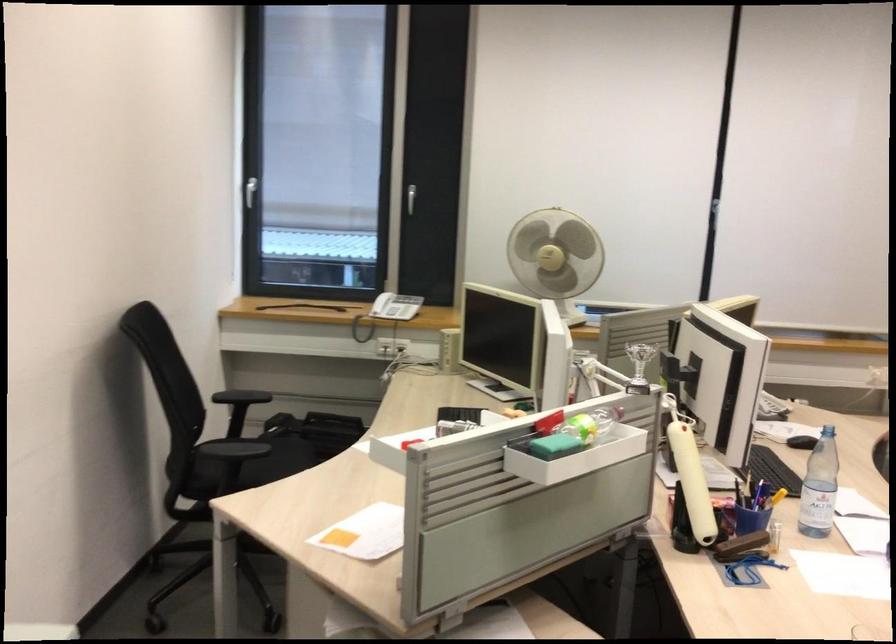
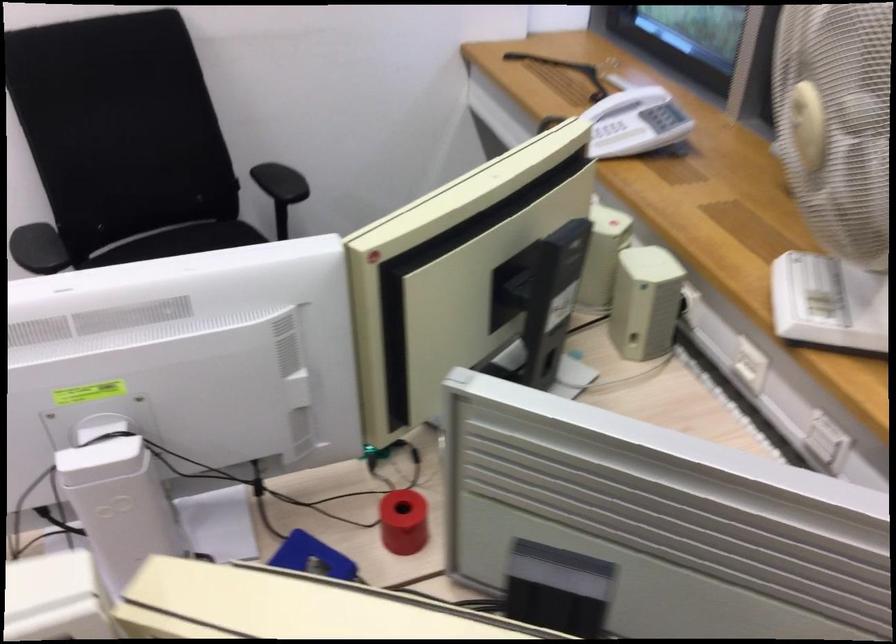
Locate, in the second image, the point that corresponds to point (383, 299) in the first image.

(634, 122)